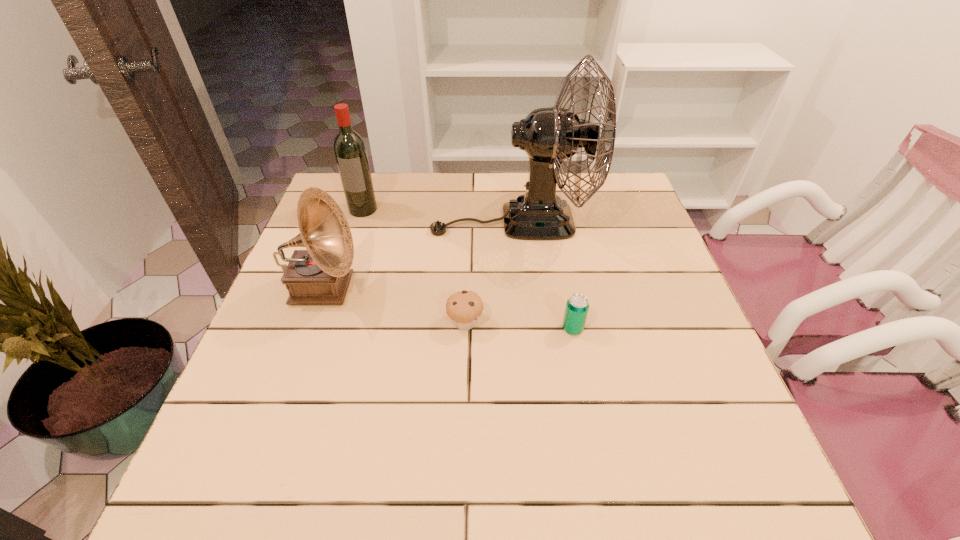
You are a GUI agent. You are given a task and a screenshot of the screen. Output one action in this format:
    pyautogui.click(x=<x>, y=<y>)
    Task: Click on the vacant space that satisfies the following two spatial constraints: 1. on the label of the beer can; 2. on the right side of the wine bottle
    The image size is (960, 540).
    Given the screenshot: What is the action you would take?
    [324, 328]

Where is `blank area in the image that satisfies the following two spatial constraints: 1. on the horn of the phonograph record; 2. on the left side of the beer can`? blank area in the image that satisfies the following two spatial constraints: 1. on the horn of the phonograph record; 2. on the left side of the beer can is located at coordinates (309, 328).

Find the location of a particular element. The width and height of the screenshot is (960, 540). free space that satisfies the following two spatial constraints: 1. on the label of the wine bottle; 2. on the horn of the third shortest object is located at coordinates (337, 289).

Identify the location of vacant area that satisfies the following two spatial constraints: 1. in front of the fan, indicating the direction of air flow; 2. on the back side of the beer can. The height and width of the screenshot is (540, 960). (522, 328).